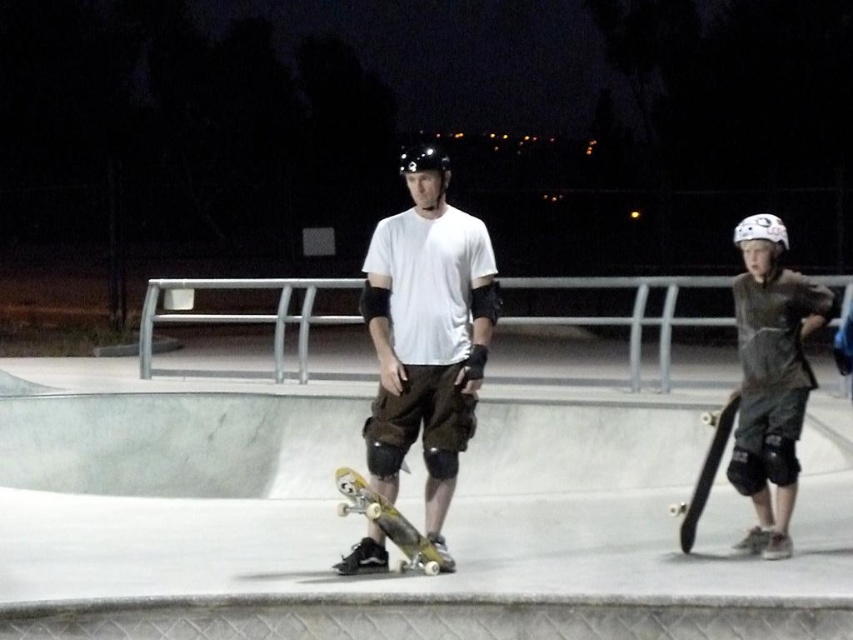
Who is lower down, wooden skateboard at center or matte white t-shirt at center?

wooden skateboard at center is below.

From the picture: Does wooden skateboard at center have a greater height compared to matte white t-shirt at center?

Incorrect, wooden skateboard at center's height is not larger of matte white t-shirt at center's.

Where is `wooden skateboard at center`? This screenshot has width=853, height=640. wooden skateboard at center is located at coordinates (363, 522).

What do you see at coordinates (770, 378) in the screenshot?
I see `matte black helmet at upper right` at bounding box center [770, 378].

Who is more forward, (755, 300) or (334, 480)?

Point (755, 300) is in front.

Find the location of a particular element. matte black helmet at upper right is located at coordinates (770, 378).

Is brushed metal rail at center shorter than wooden skateboard at right?

Incorrect, brushed metal rail at center's height does not fall short of wooden skateboard at right's.

In the scene shown: Which of these two, brushed metal rail at center or wooden skateboard at right, stands taller?

Standing taller between the two is brushed metal rail at center.

Is point (689, 320) closer to camera compared to point (717, 456)?

No, it is not.

Where is `brushed metal rail at center`? brushed metal rail at center is located at coordinates (241, 321).